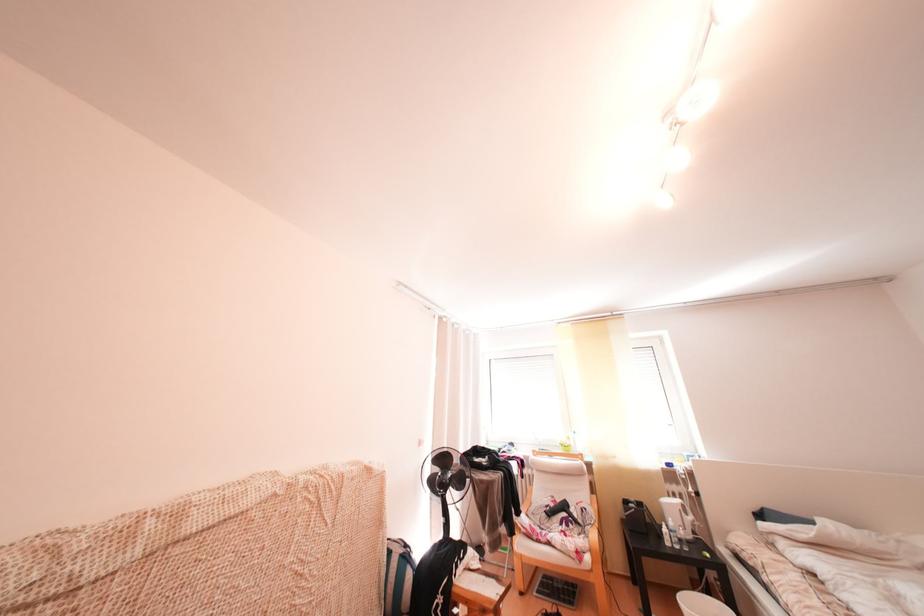
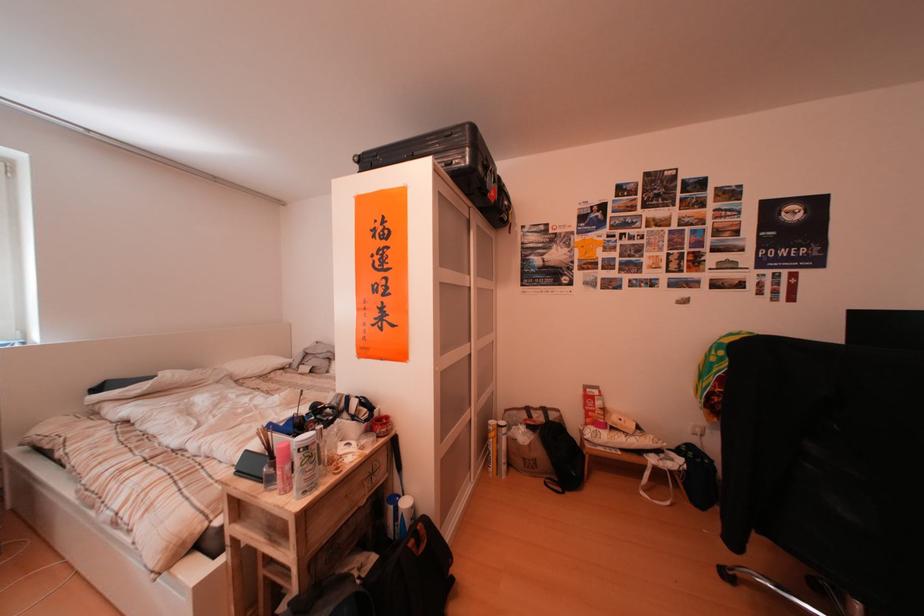
Question: The camera is either moving clockwise (left) or counter-clockwise (right) around the object. The first image is from the beginning of the video and the second image is from the end. Is the camera moving left or right when shooting the video?

Choices:
 (A) Left
 (B) Right

Answer: (A)